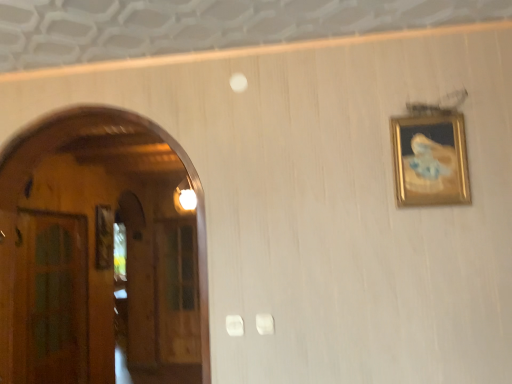
Question: Is green glass door at left, the first glass door positioned from the front, at the left side of gold-framed painting at upper right?

Choices:
 (A) yes
 (B) no

Answer: (A)

Question: Considering the relative sizes of green glass door at left, which is the 2th glass door in back-to-front order, and gold-framed painting at upper right in the image provided, is green glass door at left, which is the 2th glass door in back-to-front order, bigger than gold-framed painting at upper right?

Choices:
 (A) no
 (B) yes

Answer: (B)

Question: Can you confirm if green glass door at left, which is the 2th glass door in back-to-front order, is thinner than gold-framed painting at upper right?

Choices:
 (A) no
 (B) yes

Answer: (B)

Question: Is green glass door at left, the first glass door positioned from the front, closer to camera compared to gold-framed painting at upper right?

Choices:
 (A) no
 (B) yes

Answer: (A)

Question: From a real-world perspective, is green glass door at left, placed as the first glass door when sorted from left to right, located beneath gold-framed painting at upper right?

Choices:
 (A) yes
 (B) no

Answer: (A)

Question: Is point (179, 357) closer or farther from the camera than point (40, 289)?

Choices:
 (A) farther
 (B) closer

Answer: (A)

Question: Considering the relative positions of transparent wooden door at left, marked as the 1th glass door in a back-to-front arrangement, and green glass door at left, the first glass door positioned from the front, in the image provided, is transparent wooden door at left, marked as the 1th glass door in a back-to-front arrangement, to the left or to the right of green glass door at left, the first glass door positioned from the front,?

Choices:
 (A) right
 (B) left

Answer: (A)

Question: Relative to green glass door at left, placed as the first glass door when sorted from left to right, is transparent wooden door at left, acting as the second glass door starting from the left, in front or behind?

Choices:
 (A) front
 (B) behind

Answer: (B)

Question: From the image's perspective, relative to green glass door at left, positioned as the second glass door in right-to-left order, is transparent wooden door at left, the second glass door in the front-to-back sequence, above or below?

Choices:
 (A) above
 (B) below

Answer: (B)

Question: From a real-world perspective, is gold-framed painting at upper right physically located above or below green glass door at left, which is the 2th glass door in back-to-front order?

Choices:
 (A) above
 (B) below

Answer: (A)

Question: Relative to green glass door at left, the first glass door positioned from the front, is gold-framed painting at upper right in front or behind?

Choices:
 (A) front
 (B) behind

Answer: (A)

Question: Is gold-framed painting at upper right spatially inside green glass door at left, which is the 2th glass door in back-to-front order, or outside of it?

Choices:
 (A) outside
 (B) inside

Answer: (A)

Question: From their relative heights in the image, would you say gold-framed painting at upper right is taller or shorter than green glass door at left, the first glass door positioned from the front?

Choices:
 (A) short
 (B) tall

Answer: (A)

Question: From a real-world perspective, relative to transparent wooden door at left, the second glass door in the front-to-back sequence, is gold-framed painting at upper right vertically above or below?

Choices:
 (A) below
 (B) above

Answer: (B)

Question: In terms of width, does gold-framed painting at upper right look wider or thinner when compared to transparent wooden door at left, the second glass door in the front-to-back sequence?

Choices:
 (A) wide
 (B) thin

Answer: (B)